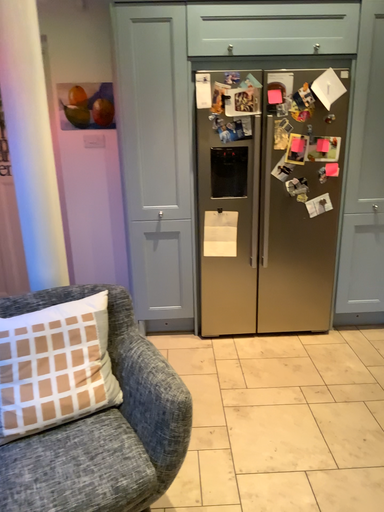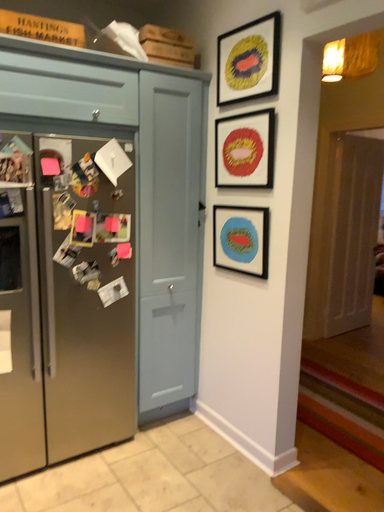
Question: Which way did the camera rotate in the video?

Choices:
 (A) rotated downward
 (B) rotated upward

Answer: (B)